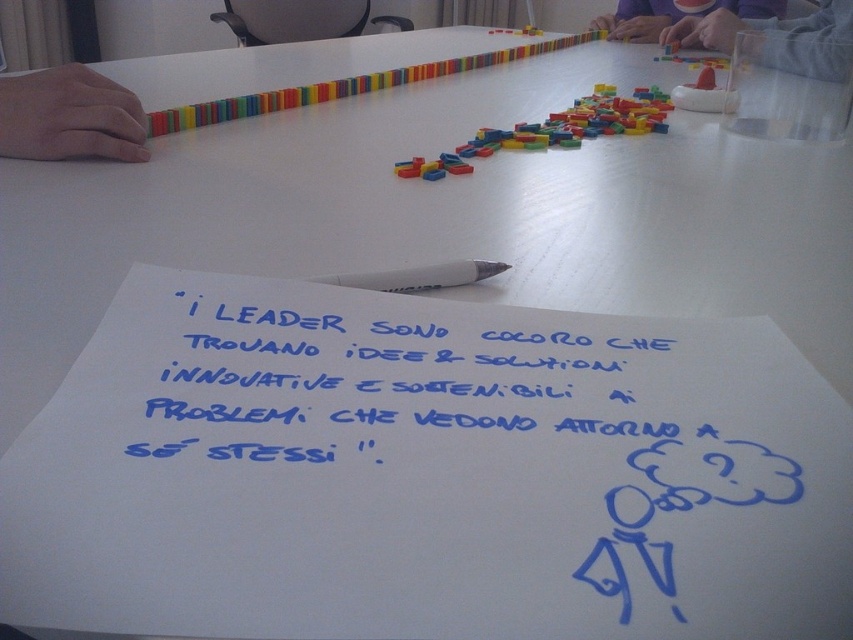
Question: Does matte plastic dominoes at upper center come in front of white plastic pen at center?

Choices:
 (A) yes
 (B) no

Answer: (B)

Question: Which of the following is the farthest from the observer?

Choices:
 (A) (396, 163)
 (B) (624, 13)
 (C) (160, 337)

Answer: (B)

Question: Observing the image, what is the correct spatial positioning of matte skin hand at left in reference to matte plastic dominoes at upper center?

Choices:
 (A) left
 (B) right

Answer: (A)

Question: Which of these objects is positioned closest to the blue ink writing at center?

Choices:
 (A) multicolored plastic blocks at upper right
 (B) matte skin hand at left
 (C) matte plastic dominoes at upper center
 (D) matte plastic cup at upper right

Answer: (B)

Question: Considering the real-world distances, which object is farthest from the multicolored plastic blocks at upper right?

Choices:
 (A) matte plastic dominoes at upper center
 (B) matte skin hand at left
 (C) matte plastic cup at upper right

Answer: (A)

Question: Can you confirm if matte plastic cup at upper right is positioned to the right of translucent plastic cup at upper right?

Choices:
 (A) no
 (B) yes

Answer: (B)